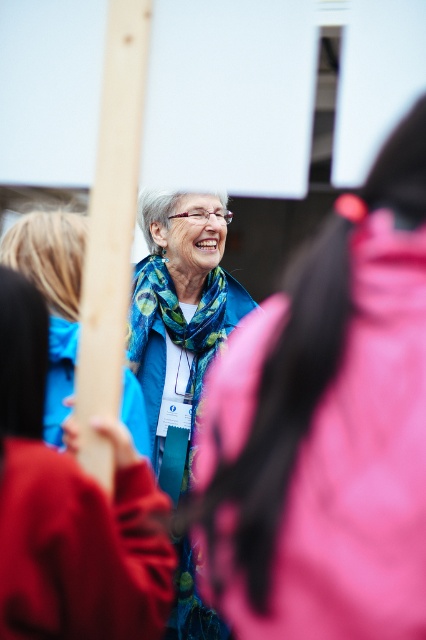
You are a fashion designer observing the scene. You notice the blue fabric jacket at center and the matte blue scarf at center. Which item is shorter in height?

The blue fabric jacket at center is not as tall as the matte blue scarf at center, so the blue fabric jacket at center is shorter in height.

You are organizing a photo shoot and need to ensure that the blue fabric jacket at center and the matte blue scarf at center are visible in the frame. Given their sizes, which object should you focus on to ensure both are captured clearly?

The blue fabric jacket at center occupies less space than the matte blue scarf at center, so you should focus on the matte blue scarf at center to ensure both are captured clearly.

You are a photographer at the event and want to focus on the blue fabric jacket at center without the matte blue scarf at center appearing in the shot. Is it possible to do so given their positions?

The blue fabric jacket at center is in front of the matte blue scarf at center, so you can focus on the blue fabric jacket at center without the matte blue scarf at center appearing in the shot by adjusting the camera angle to block the scarf with the jacket.